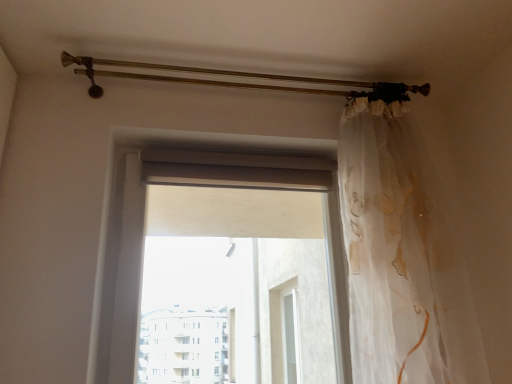
Question: In terms of size, does translucent fabric at center appear bigger or smaller than translucent white curtain at right?

Choices:
 (A) big
 (B) small

Answer: (B)

Question: Relative to translucent white curtain at right, is translucent fabric at center in front or behind?

Choices:
 (A) behind
 (B) front

Answer: (A)

Question: Looking at their shapes, would you say translucent fabric at center is wider or thinner than translucent white curtain at right?

Choices:
 (A) wide
 (B) thin

Answer: (B)

Question: Would you say translucent white curtain at right is to the left or to the right of translucent fabric at center in the picture?

Choices:
 (A) left
 (B) right

Answer: (B)

Question: Is translucent white curtain at right bigger or smaller than translucent fabric at center?

Choices:
 (A) small
 (B) big

Answer: (B)

Question: From the image's perspective, is translucent white curtain at right above or below translucent fabric at center?

Choices:
 (A) below
 (B) above

Answer: (B)

Question: Which is correct: translucent white curtain at right is inside translucent fabric at center, or outside of it?

Choices:
 (A) outside
 (B) inside

Answer: (A)